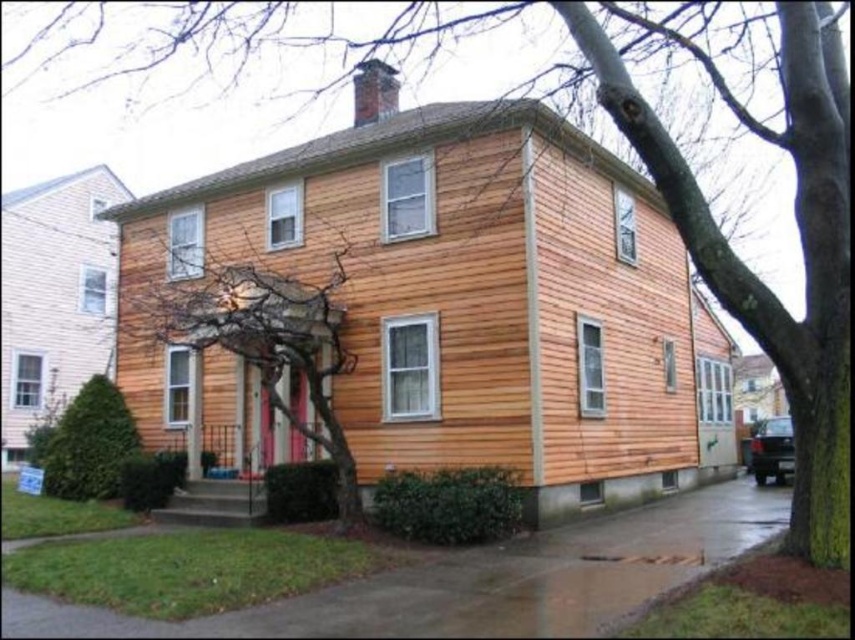
Question: Is brown textured tree at center further to camera compared to green leafy bush at lower left?

Choices:
 (A) no
 (B) yes

Answer: (A)

Question: Can you confirm if brown textured tree at center is positioned above green leafy bush at lower left?

Choices:
 (A) yes
 (B) no

Answer: (A)

Question: Can you confirm if brown textured tree at center is positioned below green leafy bush at lower left?

Choices:
 (A) no
 (B) yes

Answer: (A)

Question: Which of the following is the farthest from the observer?

Choices:
 (A) (72, 490)
 (B) (286, 273)

Answer: (A)